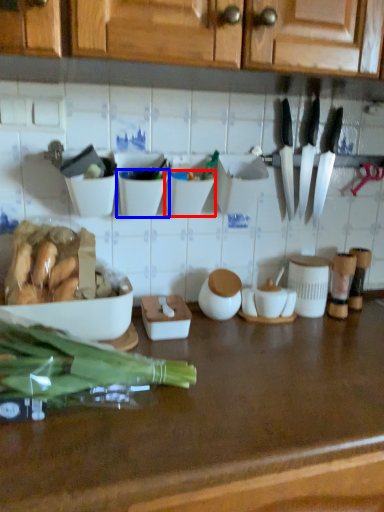
Question: Which point is further to the camera, bowl (highlighted by a red box) or bowl (highlighted by a blue box)?

Choices:
 (A) bowl
 (B) bowl

Answer: (A)